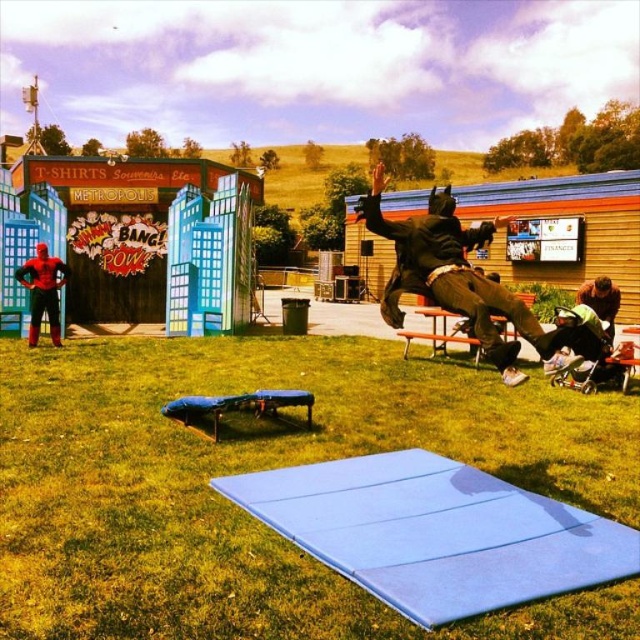
Question: From the image, what is the correct spatial relationship of dark brown leather jacket at upper center in relation to shiny red suit at lower left?

Choices:
 (A) below
 (B) above

Answer: (B)

Question: Based on their relative distances, which object is farther from the shiny red suit at lower left?

Choices:
 (A) blue foam mat at center
 (B) dark brown leather jacket at upper center

Answer: (A)

Question: Is blue foam mat at center closer to the viewer compared to shiny red suit at lower left?

Choices:
 (A) yes
 (B) no

Answer: (A)

Question: Which object is positioned farthest from the blue foam mat at center?

Choices:
 (A) dark brown leather jacket at upper center
 (B) shiny red suit at lower left

Answer: (B)

Question: Can you confirm if blue foam mat at center is bigger than dark brown leather jacket at upper center?

Choices:
 (A) yes
 (B) no

Answer: (B)

Question: Which object appears farthest from the camera in this image?

Choices:
 (A) dark brown leather jacket at upper center
 (B) blue foam mat at center
 (C) shiny red suit at lower left

Answer: (C)